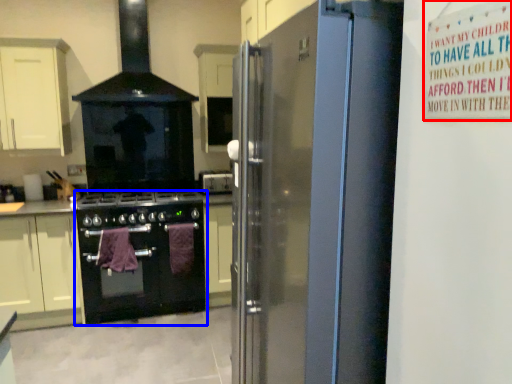
Question: Which point is further to the camera, warning sign (highlighted by a red box) or kitchen appliance (highlighted by a blue box)?

Choices:
 (A) warning sign
 (B) kitchen appliance

Answer: (B)